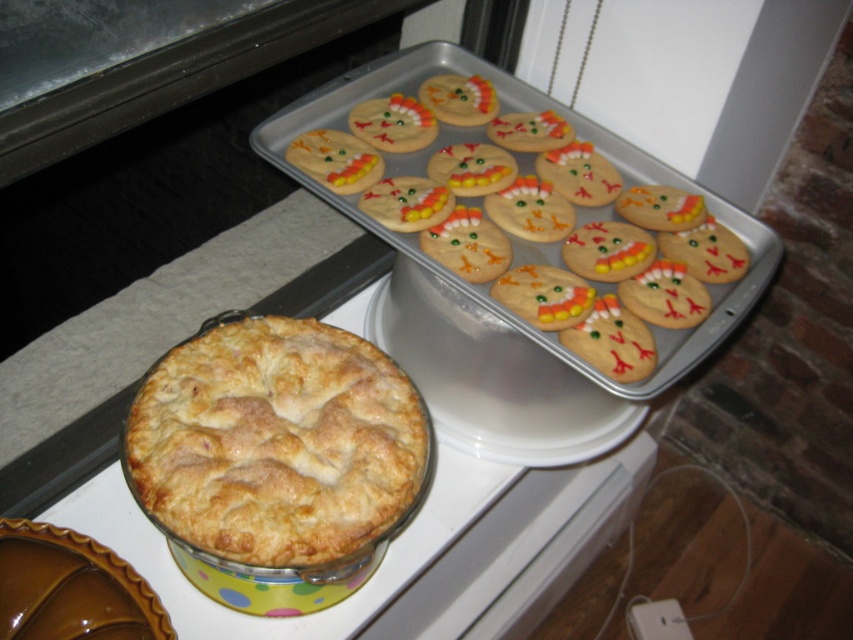
Between golden sugar cookies at upper right and golden flaky pie at center, which one has more height?

Standing taller between the two is golden sugar cookies at upper right.

Who is more forward, [419,256] or [392,513]?

Point [392,513] is in front.

Locate an element on the screen. The height and width of the screenshot is (640, 853). golden sugar cookies at upper right is located at coordinates (532, 221).